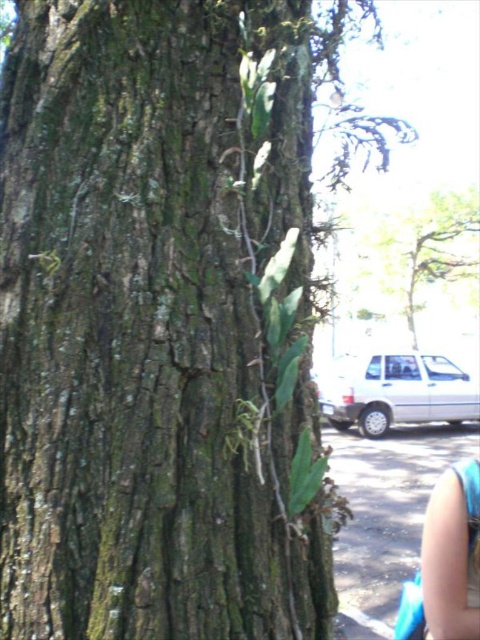
Consider the image. You are standing in front of a large tree trunk. You notice the green rough bark at center. Can you determine the exact coordinates of this bark area on the tree trunk?

The green rough bark at center is located at point (x=149, y=324).

You are a painter standing near the green rough bark at center and the blue fabric arm at lower right. You want to paint the object that is higher up. Which one should you paint?

The green rough bark at center is above the blue fabric arm at lower right, so you should paint the green rough bark at center since it is higher up.

You are a painter standing at the base of the tree. You want to paint both the green rough bark at center and the blue fabric arm at lower right. Which object should you move closer to in order to paint the finer details, considering their sizes?

The blue fabric arm at lower right is smaller in width compared to the green rough bark at center, so you should move closer to the blue fabric arm at lower right to paint its finer details effectively.